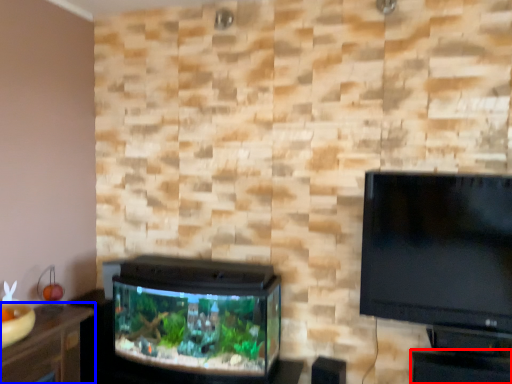
Question: Which of the following is the closest to the observer, table (highlighted by a red box) or furniture (highlighted by a blue box)?

Choices:
 (A) table
 (B) furniture

Answer: (B)